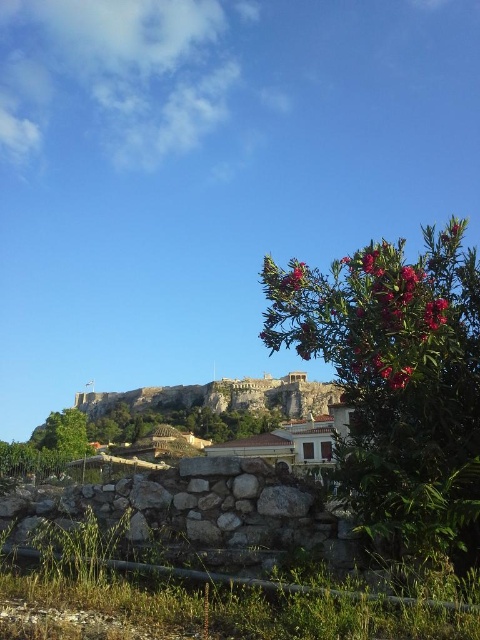
Does pink leafy bush at right have a greater width compared to pink matte flower at upper right?

Correct, the width of pink leafy bush at right exceeds that of pink matte flower at upper right.

Does pink leafy bush at right have a smaller size compared to pink matte flower at upper right?

No.

Is point (316, 289) farther from camera compared to point (428, 320)?

Yes.

Where is `pink leafy bush at right`? pink leafy bush at right is located at coordinates (396, 381).